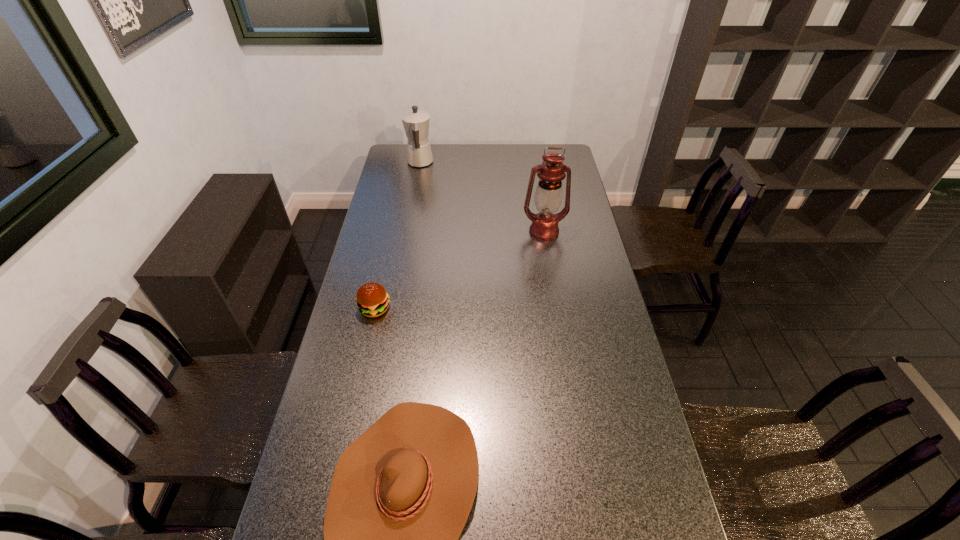
The width and height of the screenshot is (960, 540). In order to click on coffeepot that is at the left edge in this screenshot , I will do `click(416, 122)`.

At what (x,y) coordinates should I click in order to perform the action: click on hamburger positioned at the left edge. Please return your answer as a coordinate pair (x, y). The image size is (960, 540). Looking at the image, I should click on (372, 299).

Locate an element on the screen. The image size is (960, 540). object that is at the right edge is located at coordinates (548, 196).

Locate an element on the screen. object that is positioned at the far left corner is located at coordinates (416, 122).

Identify the location of vacant space at the far edge of the desktop. This screenshot has width=960, height=540. (472, 153).

The image size is (960, 540). I want to click on blank space at the left edge of the desktop, so click(x=377, y=384).

In order to click on free region at the right edge of the desktop in this screenshot , I will do `click(577, 282)`.

This screenshot has width=960, height=540. Find the location of `free region at the far left corner of the desktop`. free region at the far left corner of the desktop is located at coordinates [x=397, y=151].

At what (x,y) coordinates should I click in order to perform the action: click on blank region between the hamburger and the third shortest object. Please return your answer as a coordinate pair (x, y). Looking at the image, I should click on (397, 235).

Find the location of `vacant space in between the second shortest object and the third shortest object`. vacant space in between the second shortest object and the third shortest object is located at coordinates (397, 235).